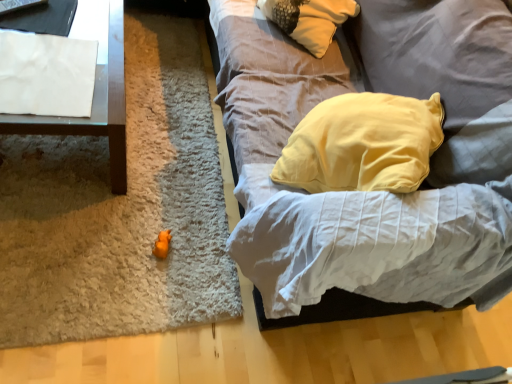
Question: Considering the relative positions of soft gray fabric couch at center and white paper at left in the image provided, is soft gray fabric couch at center behind white paper at left?

Choices:
 (A) no
 (B) yes

Answer: (A)

Question: From a real-world perspective, is soft gray fabric couch at center under white paper at left?

Choices:
 (A) no
 (B) yes

Answer: (A)

Question: Is the depth of soft gray fabric couch at center less than that of white paper at left?

Choices:
 (A) yes
 (B) no

Answer: (A)

Question: Can you confirm if soft gray fabric couch at center is shorter than white paper at left?

Choices:
 (A) no
 (B) yes

Answer: (A)

Question: Is soft gray fabric couch at center next to white paper at left and touching it?

Choices:
 (A) no
 (B) yes

Answer: (A)

Question: Considering the positions of point (163, 238) and point (23, 107), is point (163, 238) closer or farther from the camera than point (23, 107)?

Choices:
 (A) farther
 (B) closer

Answer: (A)

Question: Is orange rubber duck at center spatially inside white paper at upper left, or outside of it?

Choices:
 (A) outside
 (B) inside

Answer: (A)

Question: From their relative heights in the image, would you say orange rubber duck at center is taller or shorter than white paper at upper left?

Choices:
 (A) tall
 (B) short

Answer: (A)

Question: Would you say orange rubber duck at center is to the left or to the right of white paper at upper left in the picture?

Choices:
 (A) left
 (B) right

Answer: (B)

Question: From the image's perspective, is orange rubber duck at center positioned above or below orange plush mat at center?

Choices:
 (A) above
 (B) below

Answer: (B)

Question: Is orange rubber duck at center bigger or smaller than orange plush mat at center?

Choices:
 (A) big
 (B) small

Answer: (B)

Question: From a real-world perspective, is orange rubber duck at center above or below orange plush mat at center?

Choices:
 (A) above
 (B) below

Answer: (A)

Question: In terms of height, does orange rubber duck at center look taller or shorter compared to orange plush mat at center?

Choices:
 (A) tall
 (B) short

Answer: (A)

Question: Considering their positions, is soft gray fabric couch at center located in front of or behind orange rubber duck at center?

Choices:
 (A) front
 (B) behind

Answer: (A)

Question: From a real-world perspective, is soft gray fabric couch at center positioned above or below orange rubber duck at center?

Choices:
 (A) above
 (B) below

Answer: (A)